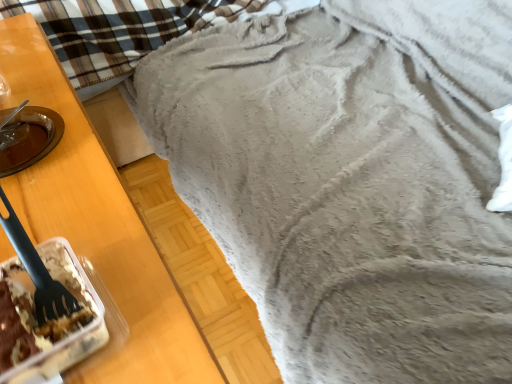
Locate an element on the screen. Image resolution: width=512 pixels, height=384 pixels. vacant space behind translucent plastic container with cake at lower left is located at coordinates (83, 216).